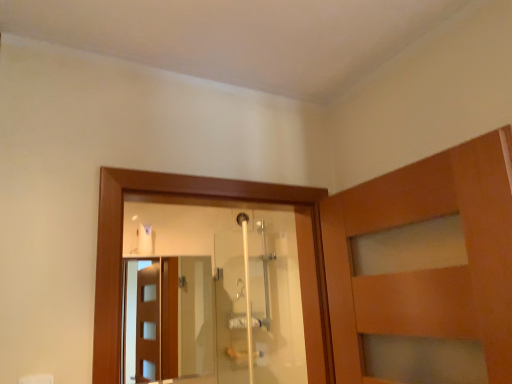
Question: From the image's perspective, relative to transparent glass screen door at center, is transparent glass shower door at center above or below?

Choices:
 (A) above
 (B) below

Answer: (A)

Question: Looking at their shapes, would you say transparent glass shower door at center is wider or thinner than transparent glass screen door at center?

Choices:
 (A) wide
 (B) thin

Answer: (B)

Question: From a real-world perspective, is transparent glass shower door at center positioned above or below transparent glass screen door at center?

Choices:
 (A) below
 (B) above

Answer: (B)

Question: Looking at their shapes, would you say transparent glass screen door at center is wider or thinner than transparent glass shower door at center?

Choices:
 (A) wide
 (B) thin

Answer: (A)

Question: From the image's perspective, is transparent glass screen door at center above or below transparent glass shower door at center?

Choices:
 (A) above
 (B) below

Answer: (B)

Question: From a real-world perspective, is transparent glass screen door at center positioned above or below transparent glass shower door at center?

Choices:
 (A) below
 (B) above

Answer: (A)

Question: In terms of size, does transparent glass screen door at center appear bigger or smaller than transparent glass shower door at center?

Choices:
 (A) big
 (B) small

Answer: (A)